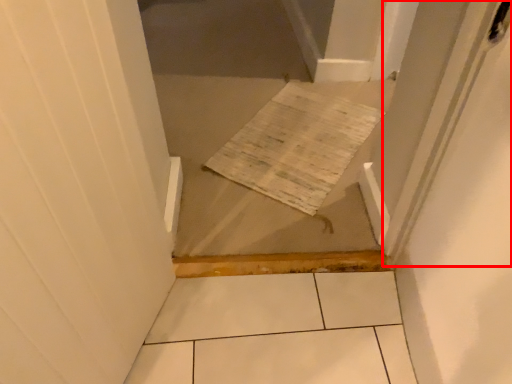
Question: Considering the relative positions of screen door (annotated by the red box) and cardboard in the image provided, where is screen door (annotated by the red box) located with respect to the staircase?

Choices:
 (A) right
 (B) left

Answer: (A)